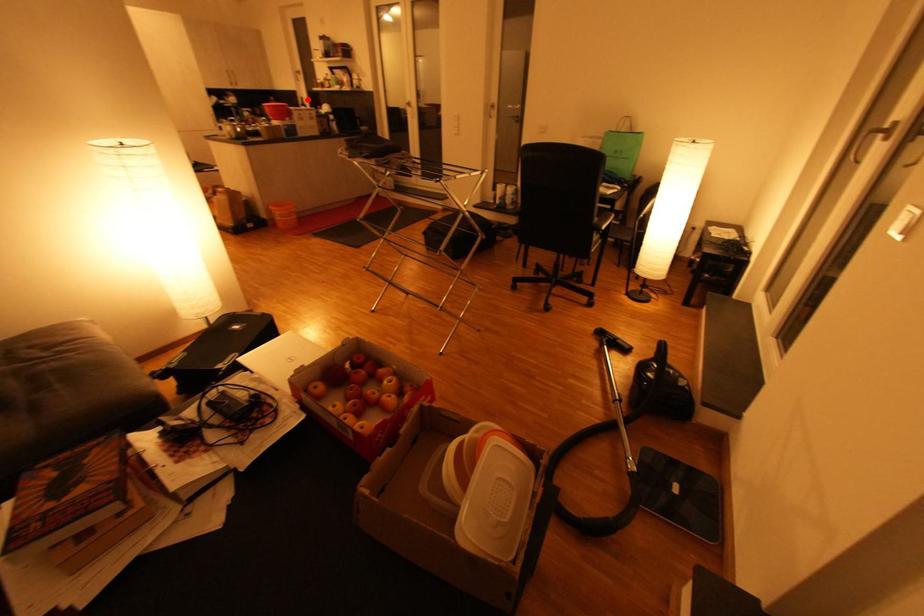
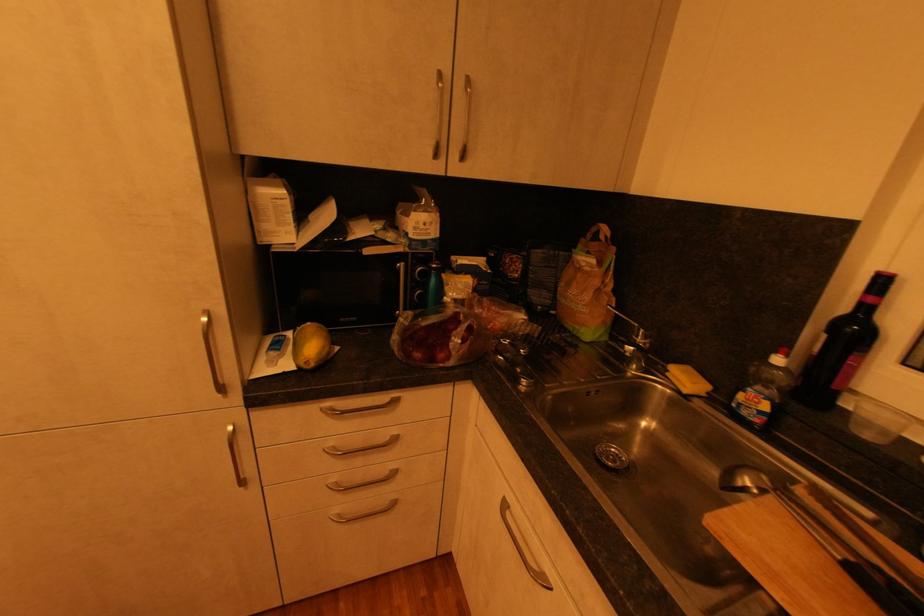
Locate, in the second image, the point that corresponds to the highlighted location in the first image.

(889, 282)